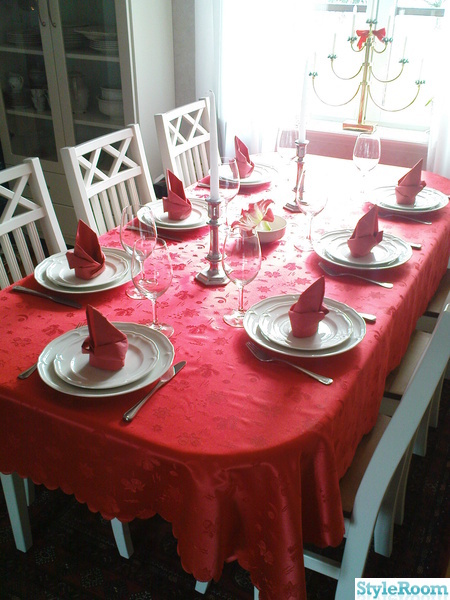
Where is `8 candles`? 8 candles is located at coordinates (352, 13), (400, 23), (403, 48), (333, 46), (310, 63), (417, 70), (303, 119), (217, 180).